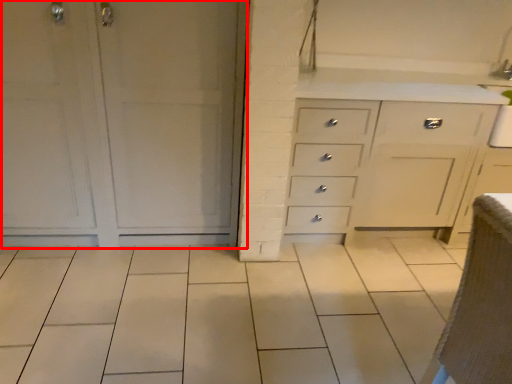
Question: From the image's perspective, considering the relative positions of door (annotated by the red box) and armchair in the image provided, where is door (annotated by the red box) located with respect to the staircase?

Choices:
 (A) above
 (B) below

Answer: (A)